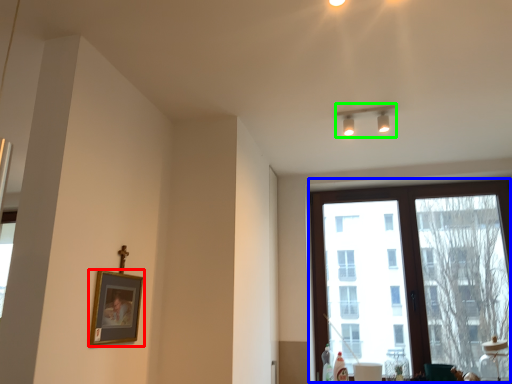
Question: Considering the real-world distances, which object is closest to picture frame (highlighted by a red box)? window (highlighted by a blue box) or lamp (highlighted by a green box).

Choices:
 (A) window
 (B) lamp

Answer: (B)